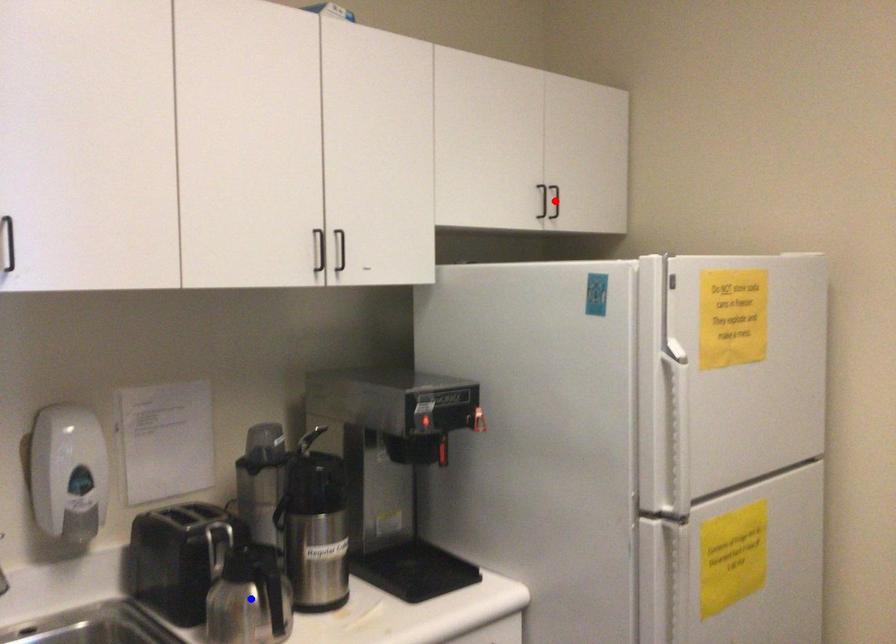
Question: In the image, two points are highlighted. Which point is nearer to the camera? Reply with the corresponding letter.

Choices:
 (A) blue point
 (B) red point

Answer: (A)